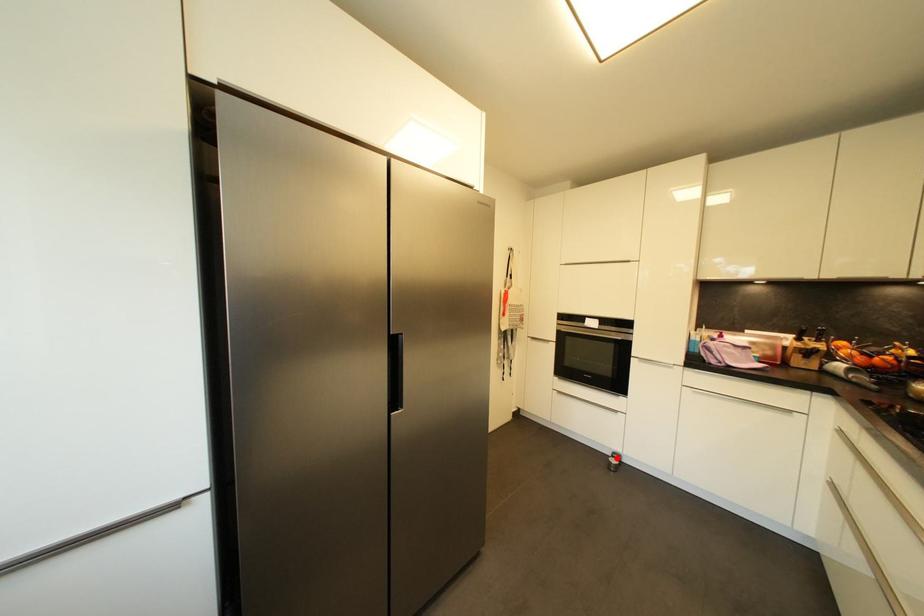
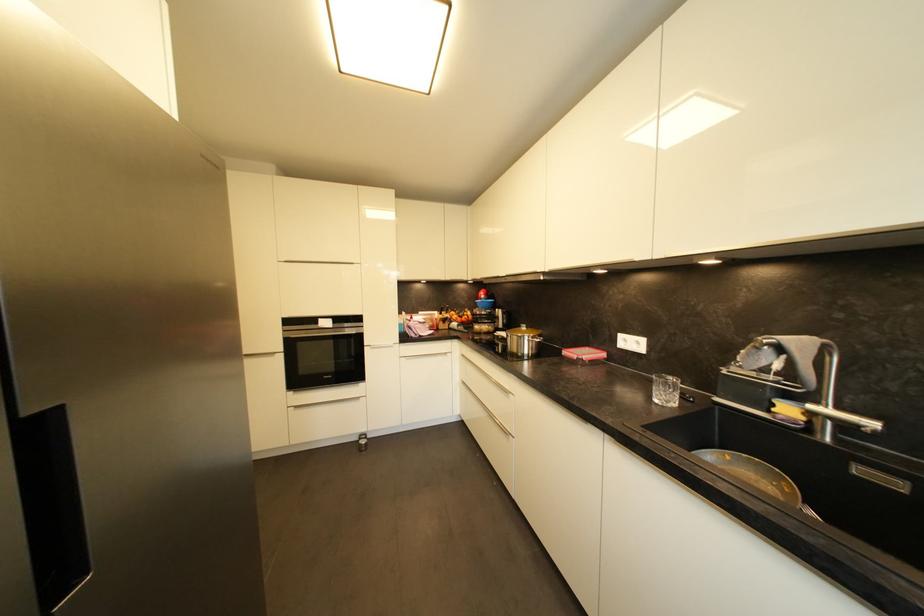
Where in the second image is the point corresponding to the highlighted location from the first image?

(365, 440)